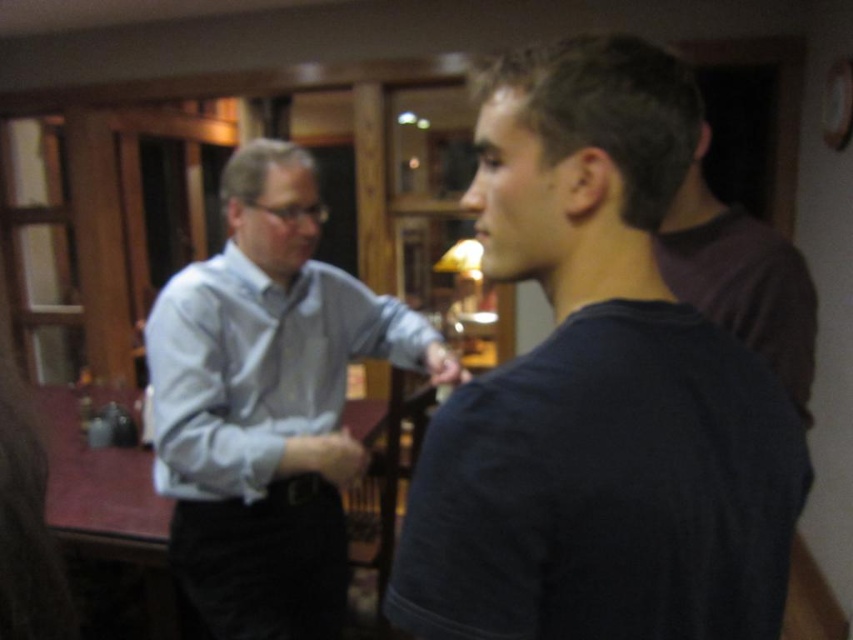
Question: Does dark blue t-shirt at center have a smaller size compared to light blue shirt at center?

Choices:
 (A) yes
 (B) no

Answer: (A)

Question: Which of the following is the closest to the observer?

Choices:
 (A) light blue shirt at center
 (B) light blue cotton shirt at left
 (C) dark blue t-shirt at center

Answer: (C)

Question: In this image, where is dark blue t-shirt at center located relative to light blue shirt at center?

Choices:
 (A) below
 (B) above

Answer: (B)

Question: Does light blue shirt at center have a greater width compared to light blue cotton shirt at left?

Choices:
 (A) no
 (B) yes

Answer: (B)

Question: Which point appears farthest from the camera in this image?

Choices:
 (A) (225, 248)
 (B) (567, 458)

Answer: (A)

Question: Considering the real-world distances, which object is farthest from the light blue shirt at center?

Choices:
 (A) light blue cotton shirt at left
 (B) dark blue t-shirt at center

Answer: (B)